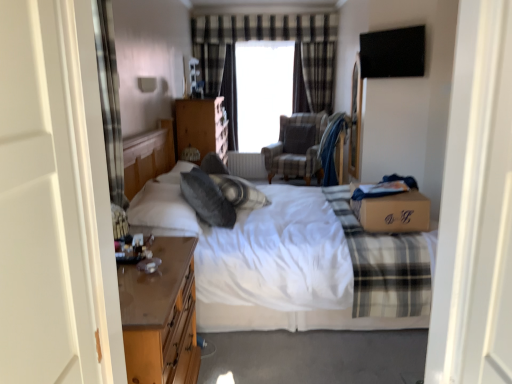
Locate an element on the screen. This screenshot has width=512, height=384. transparent glass window at center is located at coordinates (262, 91).

Locate an element on the screen. The width and height of the screenshot is (512, 384). wooden nightstand at lower left is located at coordinates pos(161,315).

In the scene shown: What is the approximate height of wooden nightstand at lower left?

The height of wooden nightstand at lower left is 28.35 inches.

Image resolution: width=512 pixels, height=384 pixels. Find the location of `gray soft pillow at center, the first pillow when ordered from right to left`. gray soft pillow at center, the first pillow when ordered from right to left is located at coordinates (298, 138).

What is the approximate height of wooden chest of drawers at center?

It is 32.59 inches.

Image resolution: width=512 pixels, height=384 pixels. What are the coordinates of `wooden chest of drawers at center` in the screenshot? It's located at tap(201, 127).

Where is `plaid fabric armchair at center`? plaid fabric armchair at center is located at coordinates (297, 147).

Does wooden chest of drawers at center appear on the left side of white cotton bed at center?

Yes, wooden chest of drawers at center is to the left of white cotton bed at center.

Considering the relative sizes of wooden chest of drawers at center and white cotton bed at center in the image provided, is wooden chest of drawers at center bigger than white cotton bed at center?

Incorrect, wooden chest of drawers at center is not larger than white cotton bed at center.

From the image's perspective, is wooden chest of drawers at center below white cotton bed at center?

Actually, wooden chest of drawers at center appears above white cotton bed at center in the image.

Would you consider wooden chest of drawers at center to be distant from white cotton bed at center?

Yes.

Is wooden chest of drawers at center facing towards white plastic radiator at center?

No.

In terms of height, does wooden chest of drawers at center look taller or shorter compared to white plastic radiator at center?

Clearly, wooden chest of drawers at center is taller compared to white plastic radiator at center.

This screenshot has height=384, width=512. In order to click on chest of drawers in front of the white plastic radiator at center in this screenshot , I will do `click(201, 127)`.

Which of these two, plaid fabric at right or plaid fabric armchair at center, is smaller?

With smaller size is plaid fabric at right.

Between plaid fabric at right and plaid fabric armchair at center, which one is positioned in front?

plaid fabric at right is in front.

Locate an element on the screen. The image size is (512, 384). chair behind the plaid fabric at right is located at coordinates (297, 147).

Is plaid fabric at right in front of plaid fabric curtain at upper center?

Yes, it is.

Can you confirm if plaid fabric at right is shorter than plaid fabric curtain at upper center?

Yes, plaid fabric at right is shorter than plaid fabric curtain at upper center.

In the scene shown: From the image's perspective, which one is positioned lower, plaid fabric at right or plaid fabric curtain at upper center?

From the image's view, plaid fabric at right is below.

Is plaid fabric at right wider or thinner than plaid fabric curtain at upper center?

Considering their sizes, plaid fabric at right looks broader than plaid fabric curtain at upper center.

Which is more to the left, plaid fabric armchair at center or gray soft pillow at center, the first pillow in the bottom-to-top sequence?

gray soft pillow at center, the first pillow in the bottom-to-top sequence, is more to the left.

Between plaid fabric armchair at center and gray soft pillow at center, positioned as the second pillow in back-to-front order, which one has less height?

gray soft pillow at center, positioned as the second pillow in back-to-front order.

Does plaid fabric armchair at center come in front of gray soft pillow at center, the first pillow in the bottom-to-top sequence?

No.

Does point (265, 149) come closer to viewer compared to point (230, 227)?

That is False.

Considering their positions, is gray soft pillow at center, positioned as the second pillow in back-to-front order, located in front of or behind white cotton bed at center?

In the image, gray soft pillow at center, positioned as the second pillow in back-to-front order, appears behind white cotton bed at center.

From a real-world perspective, is gray soft pillow at center, positioned as the second pillow in back-to-front order, under white cotton bed at center?

No, from a real-world perspective, gray soft pillow at center, positioned as the second pillow in back-to-front order, is not under white cotton bed at center.

In the scene shown: Does gray soft pillow at center, positioned as the second pillow in back-to-front order, have a lesser height compared to white cotton bed at center?

Correct, gray soft pillow at center, positioned as the second pillow in back-to-front order, is not as tall as white cotton bed at center.

Which object is positioned more to the right, white plastic radiator at center or plaid fabric curtain at upper center?

From the viewer's perspective, plaid fabric curtain at upper center appears more on the right side.

From a real-world perspective, which object rests below the other?

white plastic radiator at center, from a real-world perspective.

At what (x,y) coordinates should I click in order to perform the action: click on radiator that appears behind the plaid fabric curtain at upper center. Please return your answer as a coordinate pair (x, y). Looking at the image, I should click on (246, 165).

How many degrees apart are the facing directions of white plastic radiator at center and plaid fabric curtain at upper center?

white plastic radiator at center and plaid fabric curtain at upper center are facing 1.33 degrees away from each other.

Where is `chest of drawers that is on the left side of white cotton bed at center`? The image size is (512, 384). chest of drawers that is on the left side of white cotton bed at center is located at coordinates (201, 127).

Image resolution: width=512 pixels, height=384 pixels. Identify the location of chest of drawers above the white plastic radiator at center (from the image's perspective). (201, 127).

Considering their positions, is gray soft pillow at center, which is counted as the 2th pillow, starting from the top, positioned closer to plaid fabric armchair at center than wooden chest of drawers at center?

The object closer to plaid fabric armchair at center is wooden chest of drawers at center.

From the image, which object appears to be nearer to wooden nightstand at lower left, white cotton bed at center or gray soft pillow at center, the first pillow when ordered from right to left?

white cotton bed at center.

Considering their positions, is gray soft pillow at center, the 2th pillow viewed from the right, positioned further to wooden chest of drawers at center than white plastic radiator at center?

gray soft pillow at center, the 2th pillow viewed from the right, is further to wooden chest of drawers at center.

Which object lies further to the anchor point plaid fabric at right, wooden chest of drawers at center or white cotton bed at center?

Among the two, wooden chest of drawers at center is located further to plaid fabric at right.

Estimate the real-world distances between objects in this image. Which object is closer to gray soft pillow at center, marked as the 1th pillow in a back-to-front arrangement, white plastic radiator at center or white cotton bed at center?

Among the two, white plastic radiator at center is located nearer to gray soft pillow at center, marked as the 1th pillow in a back-to-front arrangement.

From the image, which object appears to be farther from gray soft pillow at center, the first pillow in the bottom-to-top sequence, white cotton bed at center or wooden chest of drawers at center?

The object further to gray soft pillow at center, the first pillow in the bottom-to-top sequence, is wooden chest of drawers at center.

When comparing their distances from plaid fabric armchair at center, does wooden nightstand at lower left or white cotton bed at center seem closer?

white cotton bed at center is positioned closer to the anchor plaid fabric armchair at center.

Estimate the real-world distances between objects in this image. Which object is further from plaid fabric armchair at center, white plastic radiator at center or plaid fabric at right?

Among the two, plaid fabric at right is located further to plaid fabric armchair at center.

This screenshot has height=384, width=512. Find the location of `chair between plaid fabric curtain at upper center and white plastic radiator at center in the up-down direction`. chair between plaid fabric curtain at upper center and white plastic radiator at center in the up-down direction is located at coordinates (297, 147).

This screenshot has width=512, height=384. What are the coordinates of `chair between plaid fabric at right and transparent glass window at center from front to back` in the screenshot? It's located at tap(297, 147).

Find the location of a particular element. window screen located between gray soft pillow at center, the first pillow viewed from the front, and white plastic radiator at center in the depth direction is located at coordinates (262, 91).

I want to click on chair between white cotton bed at center and white plastic radiator at center along the z-axis, so click(297, 147).